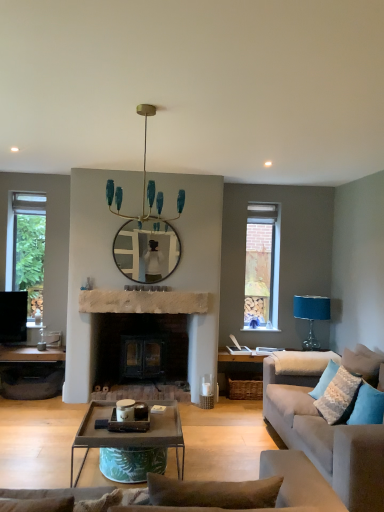
Question: Is blue fabric pillow at lower right, marked as the first pillow in a front-to-back arrangement, positioned behind metallic gray coffee table at center?

Choices:
 (A) yes
 (B) no

Answer: (A)

Question: From the image's perspective, is blue fabric pillow at lower right, marked as the first pillow in a front-to-back arrangement, beneath metallic gray coffee table at center?

Choices:
 (A) yes
 (B) no

Answer: (B)

Question: Does blue fabric pillow at lower right, marked as the first pillow in a front-to-back arrangement, turn towards metallic gray coffee table at center?

Choices:
 (A) yes
 (B) no

Answer: (A)

Question: From a real-world perspective, is blue fabric pillow at lower right, placed as the 2th pillow when sorted from back to front, located higher than metallic gray coffee table at center?

Choices:
 (A) no
 (B) yes

Answer: (B)

Question: Is blue fabric pillow at lower right, marked as the first pillow in a front-to-back arrangement, surrounding metallic gray coffee table at center?

Choices:
 (A) no
 (B) yes

Answer: (A)

Question: Is blue fabric pillow at lower right, placed as the 2th pillow when sorted from back to front, beside metallic gray coffee table at center?

Choices:
 (A) yes
 (B) no

Answer: (B)

Question: Is metallic gray coffee table at center far away from metallic silver tray at lower left?

Choices:
 (A) yes
 (B) no

Answer: (A)

Question: Is metallic gray coffee table at center oriented away from metallic silver tray at lower left?

Choices:
 (A) no
 (B) yes

Answer: (A)

Question: Can you confirm if metallic gray coffee table at center is bigger than metallic silver tray at lower left?

Choices:
 (A) no
 (B) yes

Answer: (B)

Question: Considering the relative sizes of metallic gray coffee table at center and metallic silver tray at lower left in the image provided, is metallic gray coffee table at center shorter than metallic silver tray at lower left?

Choices:
 (A) yes
 (B) no

Answer: (B)

Question: Can you confirm if metallic gray coffee table at center is positioned to the left of metallic silver tray at lower left?

Choices:
 (A) no
 (B) yes

Answer: (A)

Question: From the image's perspective, does metallic gray coffee table at center appear higher than metallic silver tray at lower left?

Choices:
 (A) yes
 (B) no

Answer: (A)

Question: From a real-world perspective, is blue fabric pillow at lower right, placed as the 2th pillow when sorted from back to front, under matte glass mirror at center?

Choices:
 (A) no
 (B) yes

Answer: (B)